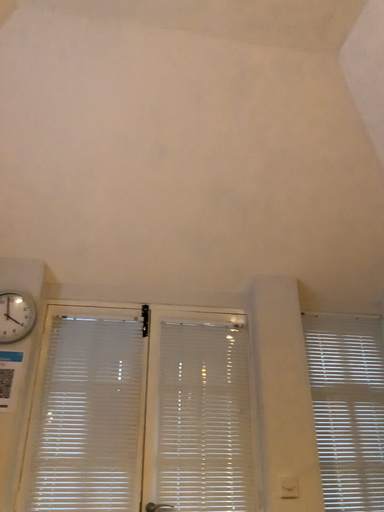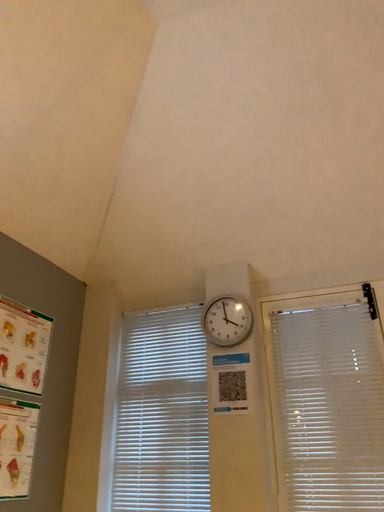
Question: How did the camera likely rotate when shooting the video?

Choices:
 (A) rotated left
 (B) rotated right

Answer: (A)